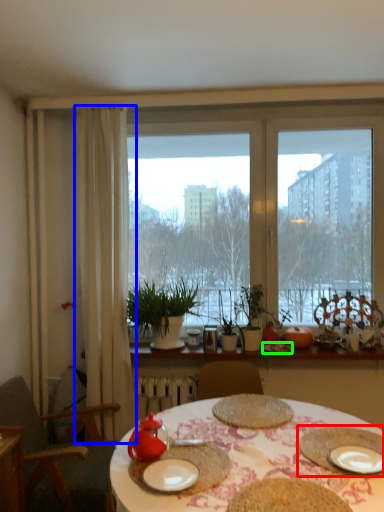
Question: Which is nearer to the platter (highlighted by a red box)? curtain (highlighted by a blue box) or tableware (highlighted by a green box).

Choices:
 (A) curtain
 (B) tableware

Answer: (B)